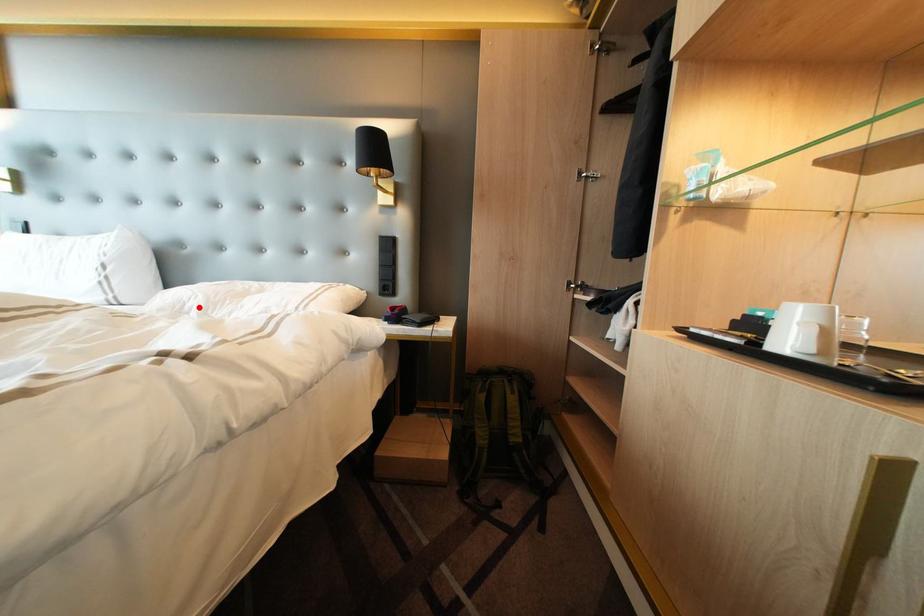
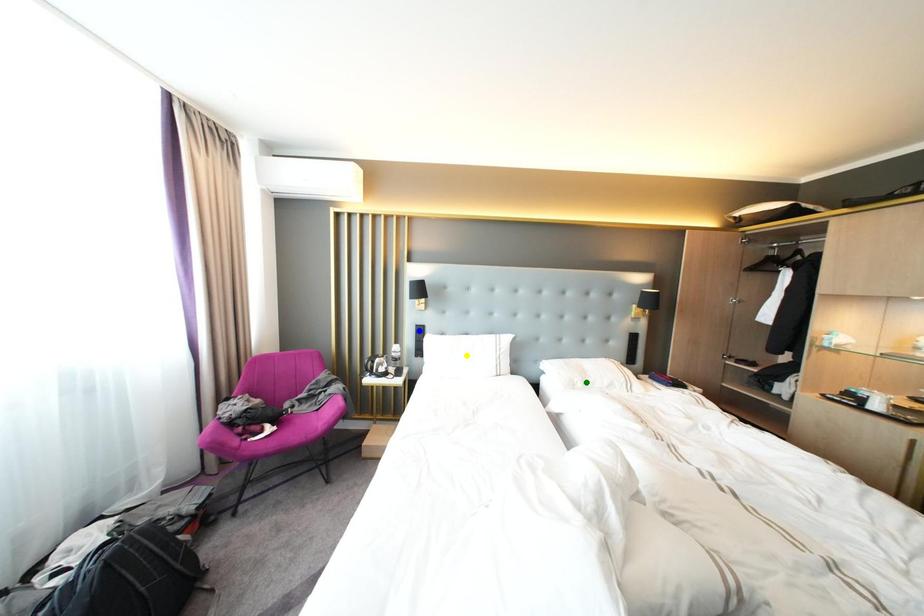
Question: I am providing you with two images of the same scene from different viewpoints. A red point is marked on the first image. You are given multiple points on the second image. Can you choose the point in image 2 that corresponds to the point in image 1?

Choices:
 (A) green point
 (B) blue point
 (C) yellow point

Answer: (A)